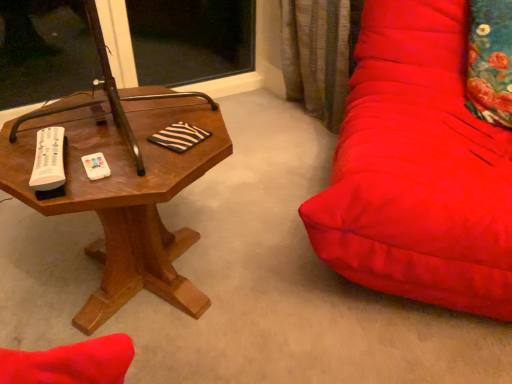
Question: Considering the positions of point (496, 122) and point (150, 241), is point (496, 122) closer or farther from the camera than point (150, 241)?

Choices:
 (A) closer
 (B) farther

Answer: (B)

Question: From the image's perspective, relative to woodenobject at left, is floral fabric pillow at right above or below?

Choices:
 (A) below
 (B) above

Answer: (B)

Question: In terms of width, does floral fabric pillow at right look wider or thinner when compared to woodenobject at left?

Choices:
 (A) thin
 (B) wide

Answer: (A)

Question: Do you think woodenobject at left is within floral fabric pillow at right, or outside of it?

Choices:
 (A) inside
 (B) outside

Answer: (B)

Question: Does point (157, 254) appear closer or farther from the camera than point (470, 19)?

Choices:
 (A) closer
 (B) farther

Answer: (A)

Question: Would you say woodenobject at left is to the left or to the right of floral fabric pillow at right in the picture?

Choices:
 (A) right
 (B) left

Answer: (B)

Question: From a real-world perspective, is woodenobject at left above or below floral fabric pillow at right?

Choices:
 (A) below
 (B) above

Answer: (A)